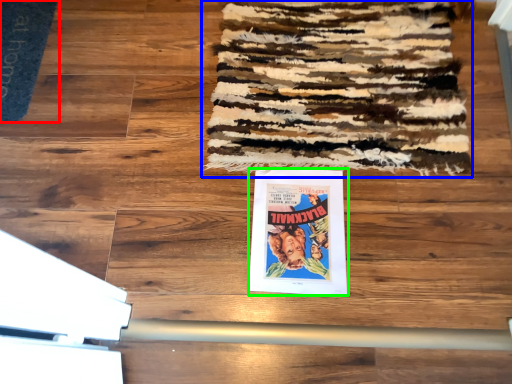
Question: Which is nearer to the doormat (highlighted by a red box)? mat (highlighted by a blue box) or poster (highlighted by a green box).

Choices:
 (A) mat
 (B) poster

Answer: (A)